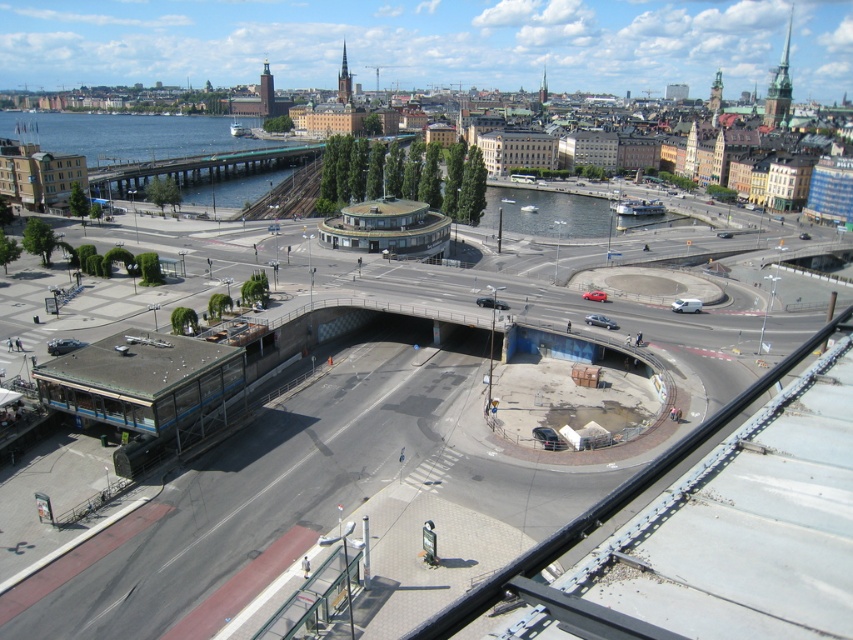
You are a delivery driver who needs to cross the bridge to reach your destination. You see the blue water at left and the silver metallic sedan at center. Which object is located higher in the image?

The blue water at left is above the silver metallic sedan at center, so the blue water at left is higher in the image.